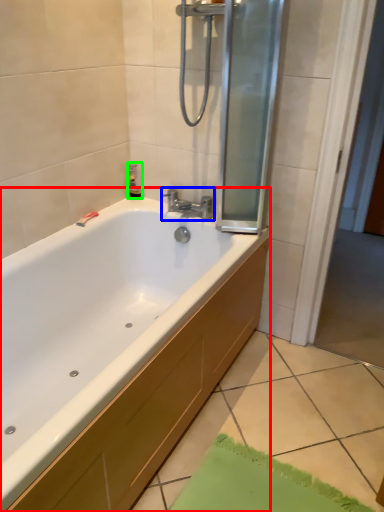
Question: Considering the real-world distances, which object is closest to bathtub (highlighted by a red box)? tap (highlighted by a blue box) or toiletry (highlighted by a green box).

Choices:
 (A) tap
 (B) toiletry

Answer: (A)